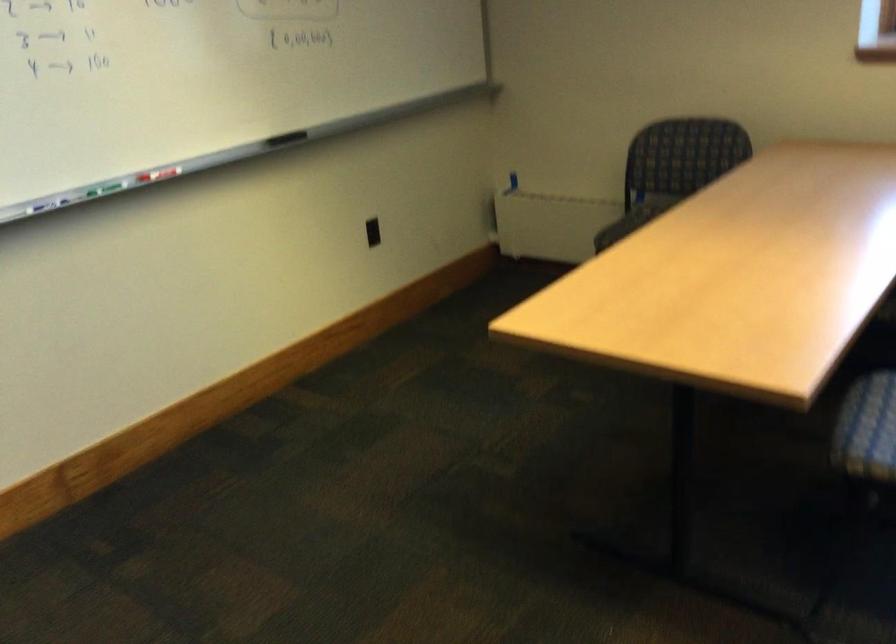
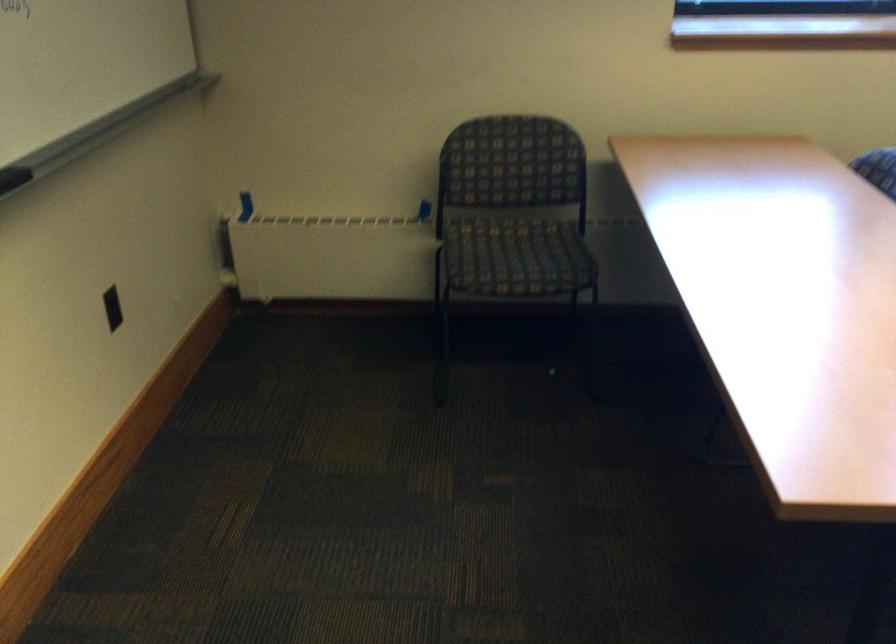
Locate, in the second image, the point that corresponds to [280,133] in the first image.

(13, 178)